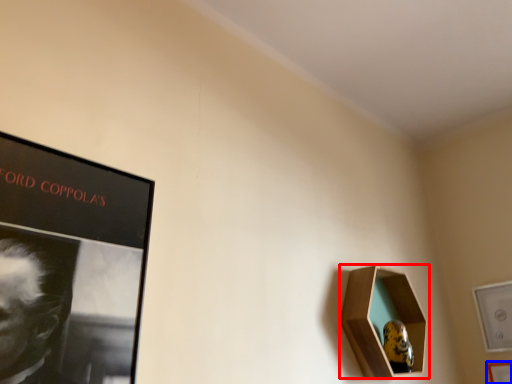
Question: Which of the following is the closest to the observer, picture frame (highlighted by a red box) or picture frame (highlighted by a blue box)?

Choices:
 (A) picture frame
 (B) picture frame

Answer: (A)